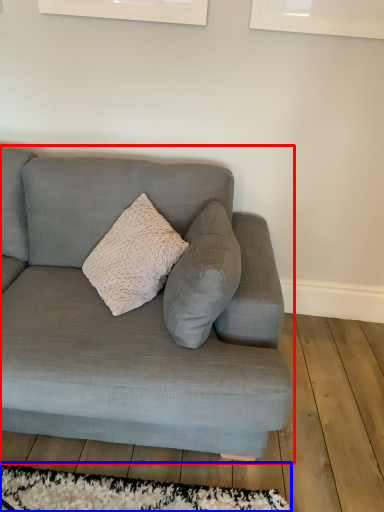
Question: Which point is further to the camera, studio couch (highlighted by a red box) or mat (highlighted by a blue box)?

Choices:
 (A) studio couch
 (B) mat

Answer: (B)